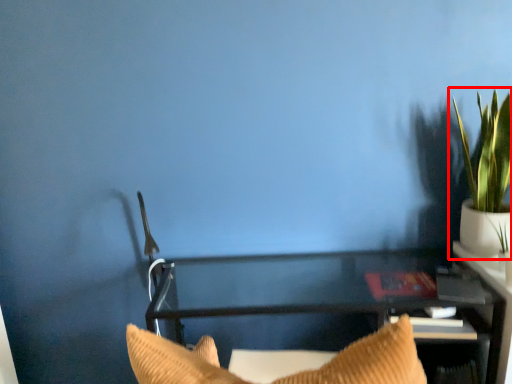
Question: From the image, what is the correct spatial relationship of houseplant (annotated by the red box) in relation to furniture?

Choices:
 (A) right
 (B) left

Answer: (A)